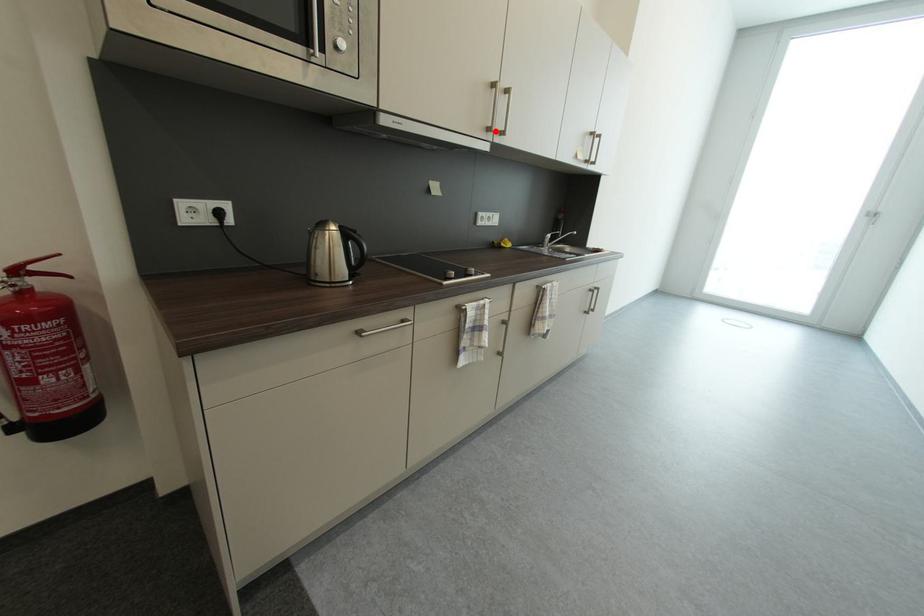
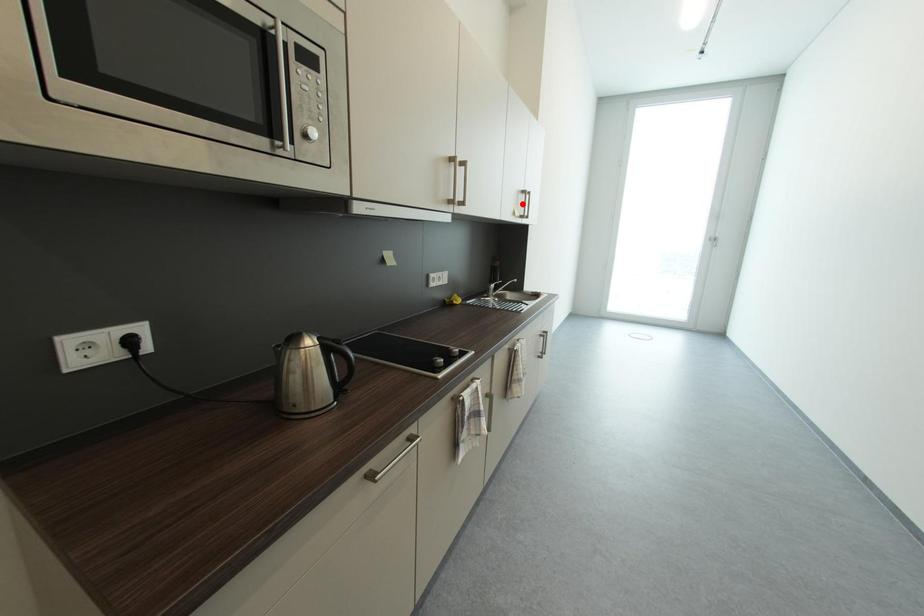
I am providing you with two images of the same scene from different viewpoints. A red point is marked on the first image and another point is marked on the second image. Are the points marked in image1 and image2 representing the same 3D position?

No